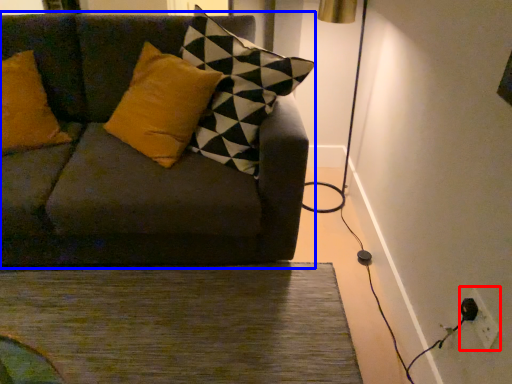
Question: Which point is further to the camera, electric outlet (highlighted by a red box) or studio couch (highlighted by a blue box)?

Choices:
 (A) electric outlet
 (B) studio couch

Answer: (B)